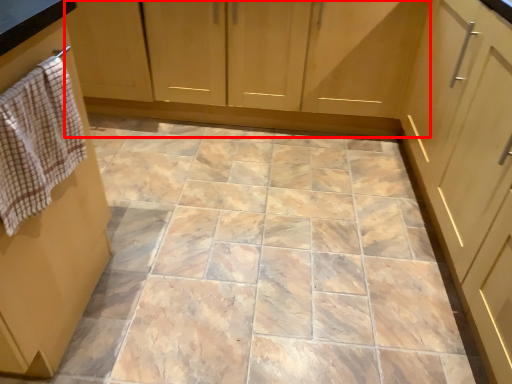
Question: From the image's perspective, what is the correct spatial relationship of cabinetry (annotated by the red box) in relation to hand towel?

Choices:
 (A) above
 (B) below

Answer: (A)